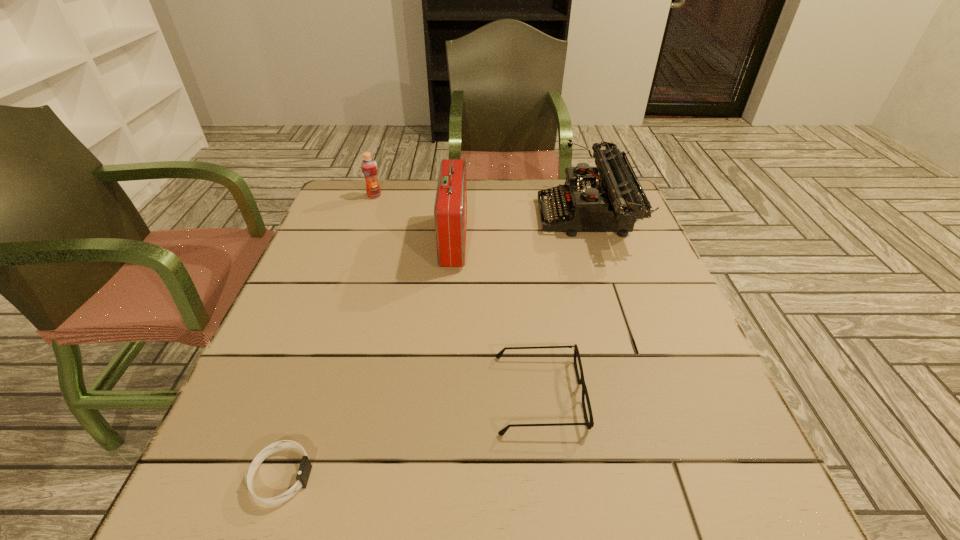
What are the coordinates of `empty location between the second shortest object and the third object from right to left` in the screenshot? It's located at (496, 318).

Where is `empty space that is in between the fourth tallest object and the typewriter`? The width and height of the screenshot is (960, 540). empty space that is in between the fourth tallest object and the typewriter is located at coordinates (563, 306).

This screenshot has height=540, width=960. Find the location of `blank region between the nearest object and the spectacles`. blank region between the nearest object and the spectacles is located at coordinates (411, 435).

Where is `vacant area that lies between the shortest object and the typewriter`? vacant area that lies between the shortest object and the typewriter is located at coordinates (434, 347).

In order to click on vacant area that lies between the orange juice and the shortest object in this screenshot , I will do `click(328, 336)`.

At what (x,y) coordinates should I click in order to perform the action: click on empty space between the third tallest object and the spectacles. Please return your answer as a coordinate pair (x, y). Looking at the image, I should click on (457, 295).

Where is `free spot between the typewriter and the orange juice`? free spot between the typewriter and the orange juice is located at coordinates (480, 207).

Where is `vacant area that lies between the fourth farthest object and the typewriter`? This screenshot has width=960, height=540. vacant area that lies between the fourth farthest object and the typewriter is located at coordinates (563, 306).

Find the location of a particular element. empty space between the nearest object and the second shortest object is located at coordinates (411, 435).

The width and height of the screenshot is (960, 540). I want to click on object that is the fourth closest to the typewriter, so click(305, 467).